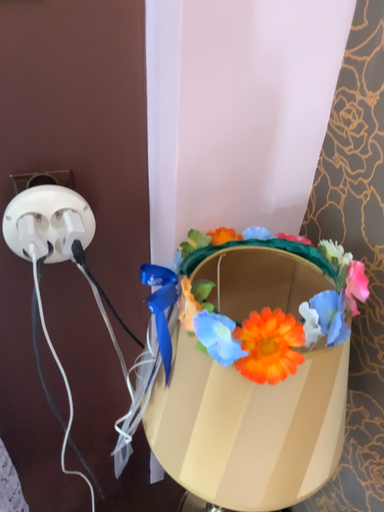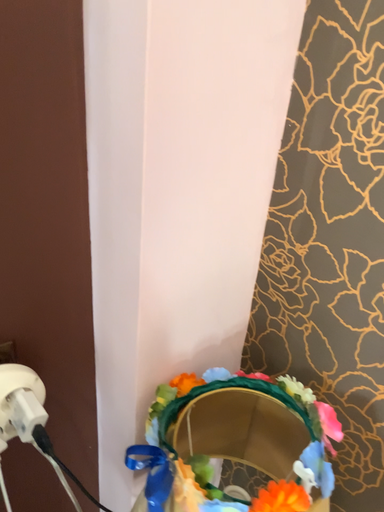
Question: Which way did the camera rotate in the video?

Choices:
 (A) rotated right
 (B) rotated left

Answer: (A)